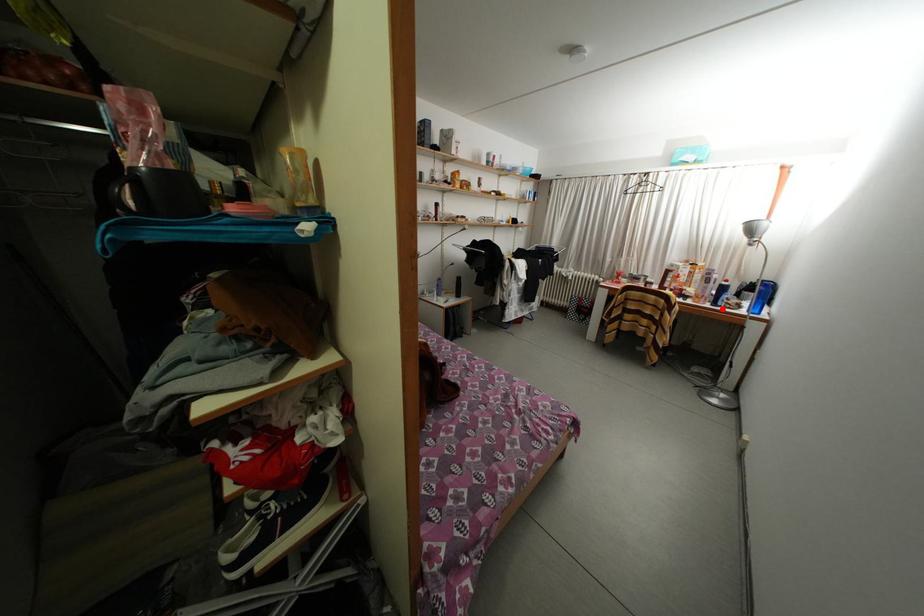
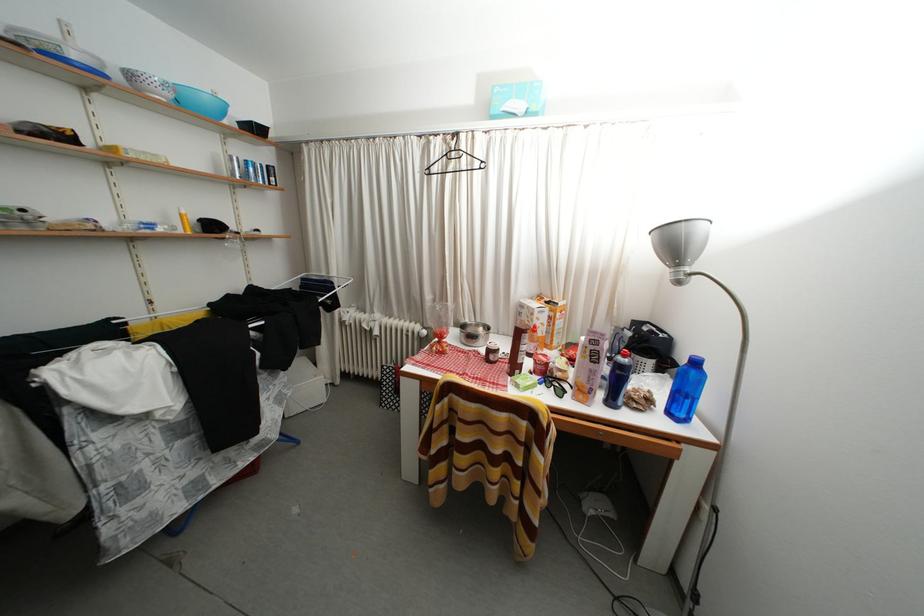
Find the pixel in the second image that matches the highlighted location in the first image.

(618, 408)